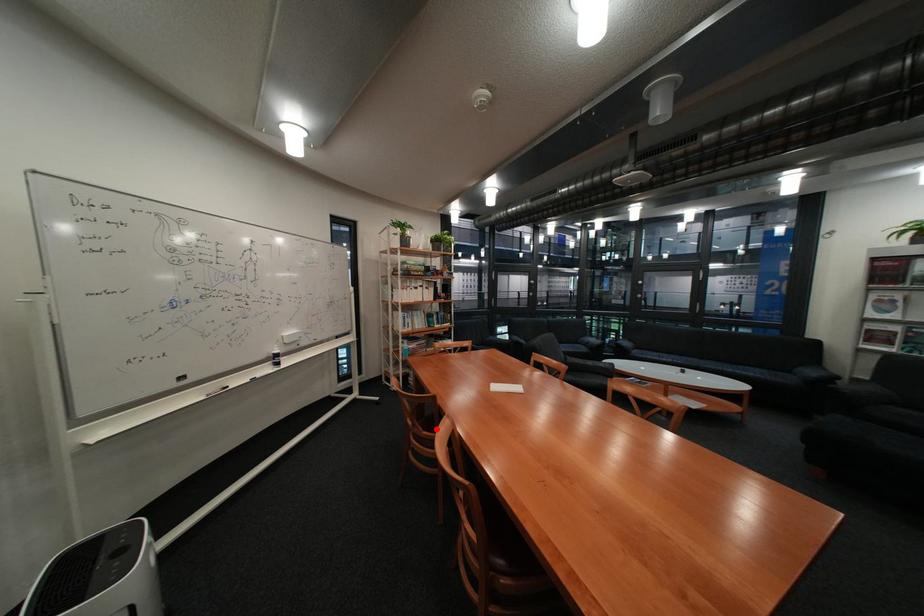
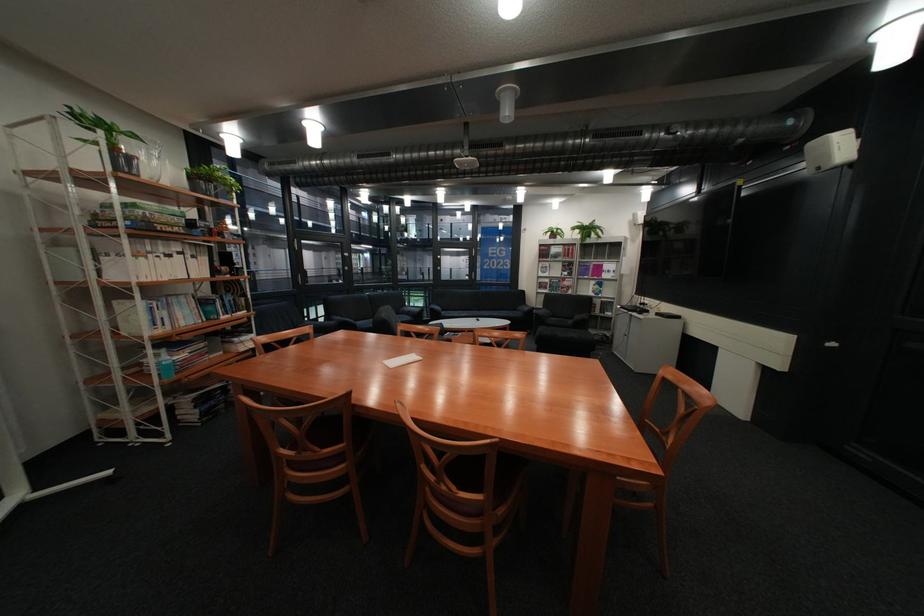
In the second image, find the point that corresponds to the highlighted location in the first image.

(333, 450)